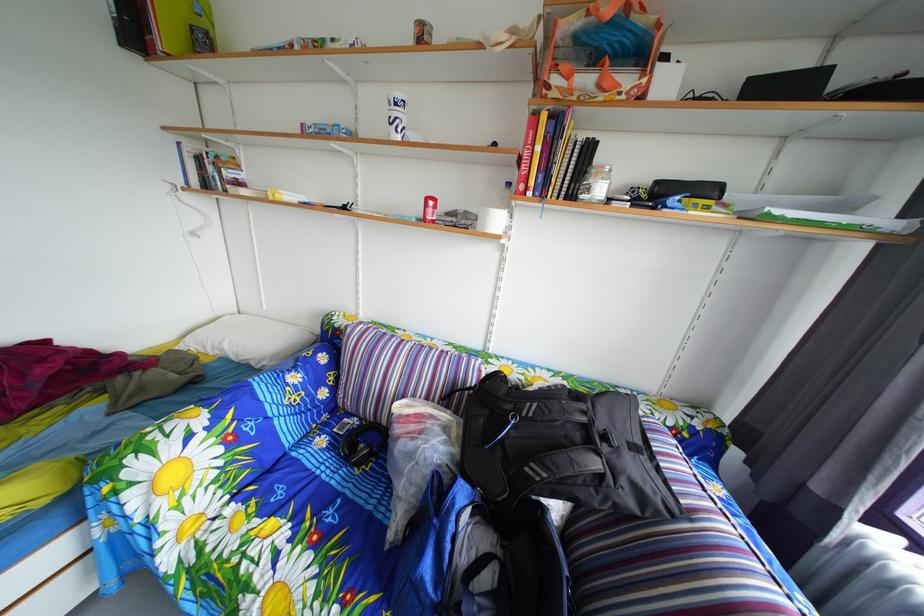
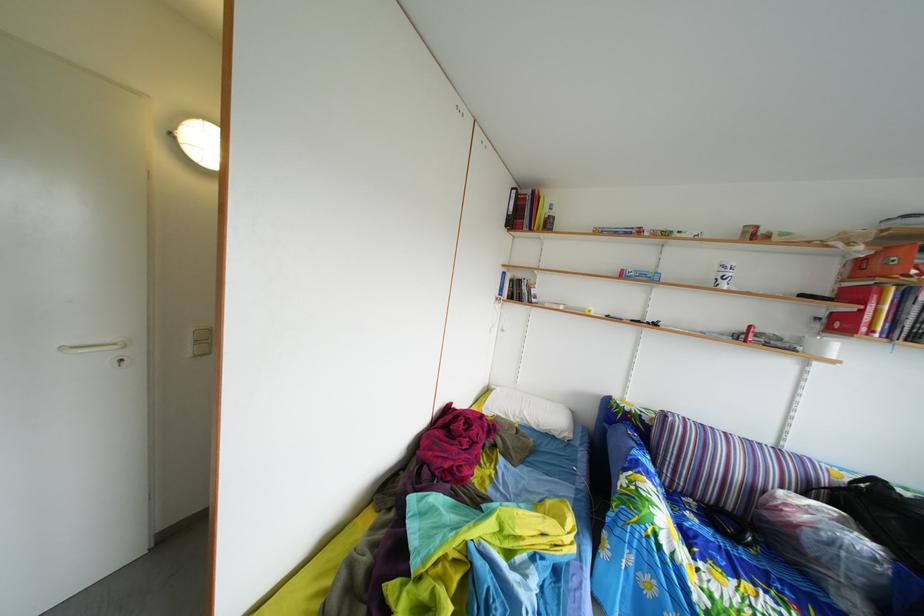
Find the pixel in the second image that matches the point at 395,431 in the first image.

(739, 516)